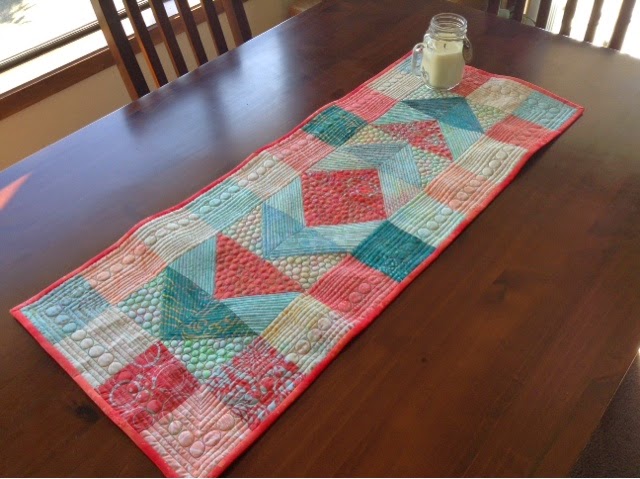
Locate an element on the screen. This screenshot has height=479, width=640. candle is located at coordinates (440, 57).